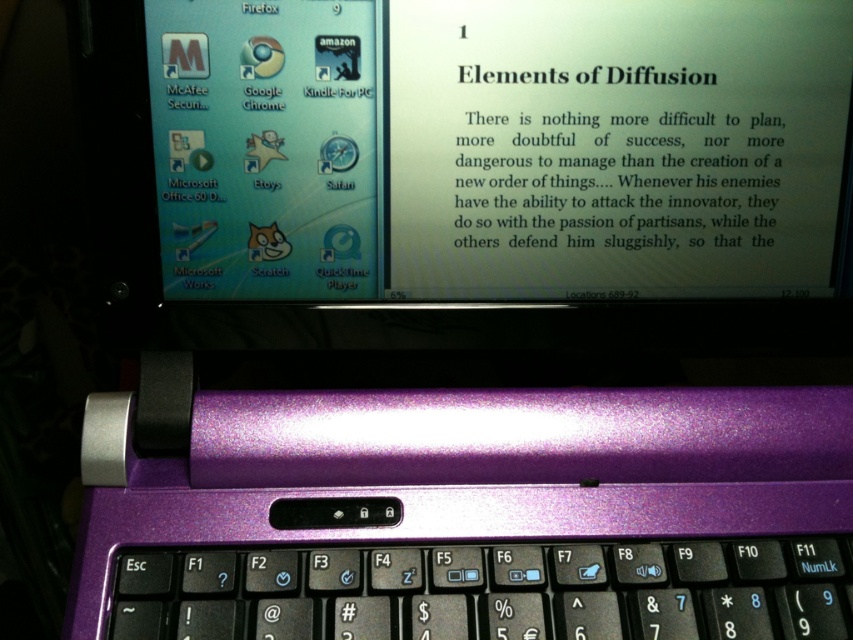
Question: Is purple metallic laptop at upper center to the left of purple metallic keyboard at center from the viewer's perspective?

Choices:
 (A) no
 (B) yes

Answer: (A)

Question: Which point appears farthest from the camera in this image?

Choices:
 (A) pos(524,588)
 (B) pos(677,268)

Answer: (B)

Question: Observing the image, what is the correct spatial positioning of purple metallic laptop at upper center in reference to purple metallic keyboard at center?

Choices:
 (A) below
 (B) above

Answer: (B)

Question: Which point is farther from the camera taking this photo?

Choices:
 (A) (305, 186)
 (B) (650, 580)

Answer: (A)

Question: Is purple metallic laptop at upper center smaller than purple metallic keyboard at center?

Choices:
 (A) yes
 (B) no

Answer: (B)